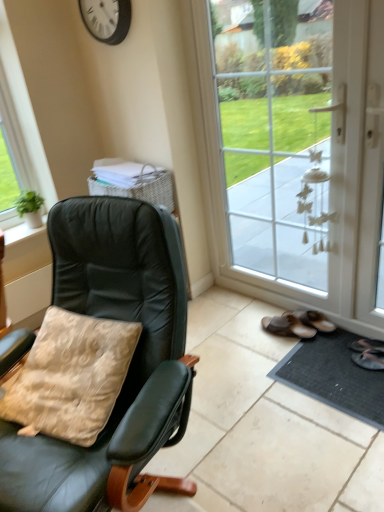
Question: Considering the relative sizes of white glass door at center and beige velvety pillow at left in the image provided, is white glass door at center taller than beige velvety pillow at left?

Choices:
 (A) no
 (B) yes

Answer: (B)

Question: From a real-world perspective, is white glass door at center beneath beige velvety pillow at left?

Choices:
 (A) yes
 (B) no

Answer: (B)

Question: Considering the relative sizes of white glass door at center and beige velvety pillow at left in the image provided, is white glass door at center thinner than beige velvety pillow at left?

Choices:
 (A) yes
 (B) no

Answer: (A)

Question: Considering the relative positions of white glass door at center and beige velvety pillow at left in the image provided, is white glass door at center to the left of beige velvety pillow at left from the viewer's perspective?

Choices:
 (A) no
 (B) yes

Answer: (A)

Question: Is white glass door at center positioned in front of beige velvety pillow at left?

Choices:
 (A) no
 (B) yes

Answer: (A)

Question: Does white glass door at center come behind beige velvety pillow at left?

Choices:
 (A) yes
 (B) no

Answer: (A)

Question: Is white plastic clock at upper center to the right of matte black chair at left from the viewer's perspective?

Choices:
 (A) yes
 (B) no

Answer: (B)

Question: Is white plastic clock at upper center directly adjacent to matte black chair at left?

Choices:
 (A) no
 (B) yes

Answer: (A)

Question: Does white plastic clock at upper center have a greater width compared to matte black chair at left?

Choices:
 (A) yes
 (B) no

Answer: (B)

Question: Can you confirm if white plastic clock at upper center is thinner than matte black chair at left?

Choices:
 (A) no
 (B) yes

Answer: (B)

Question: Does white plastic clock at upper center have a lesser height compared to matte black chair at left?

Choices:
 (A) yes
 (B) no

Answer: (A)

Question: Could you tell me if white plastic clock at upper center is turned towards matte black chair at left?

Choices:
 (A) no
 (B) yes

Answer: (A)

Question: Considering the relative sizes of white plastic clock at upper center and black rubber doormat at lower right in the image provided, is white plastic clock at upper center taller than black rubber doormat at lower right?

Choices:
 (A) yes
 (B) no

Answer: (A)